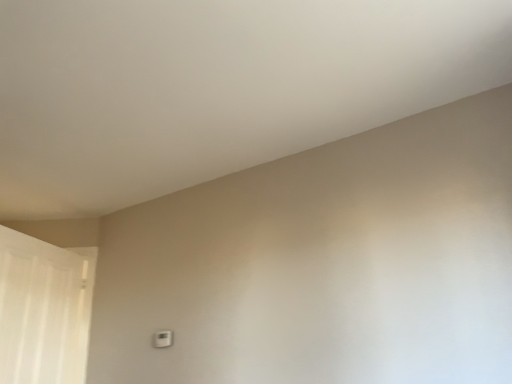
The image size is (512, 384). What do you see at coordinates (42, 311) in the screenshot?
I see `white sheer curtain at left` at bounding box center [42, 311].

In order to click on white sheer curtain at left in this screenshot , I will do `click(42, 311)`.

Image resolution: width=512 pixels, height=384 pixels. I want to click on white sheer curtain at left, so click(x=42, y=311).